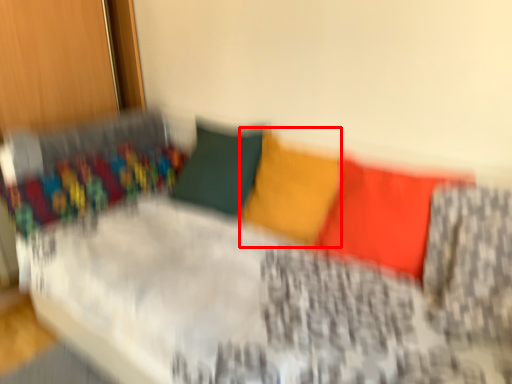
Question: Considering the relative positions of pillow (annotated by the red box) and pillow in the image provided, where is pillow (annotated by the red box) located with respect to the staircase?

Choices:
 (A) left
 (B) right

Answer: (A)